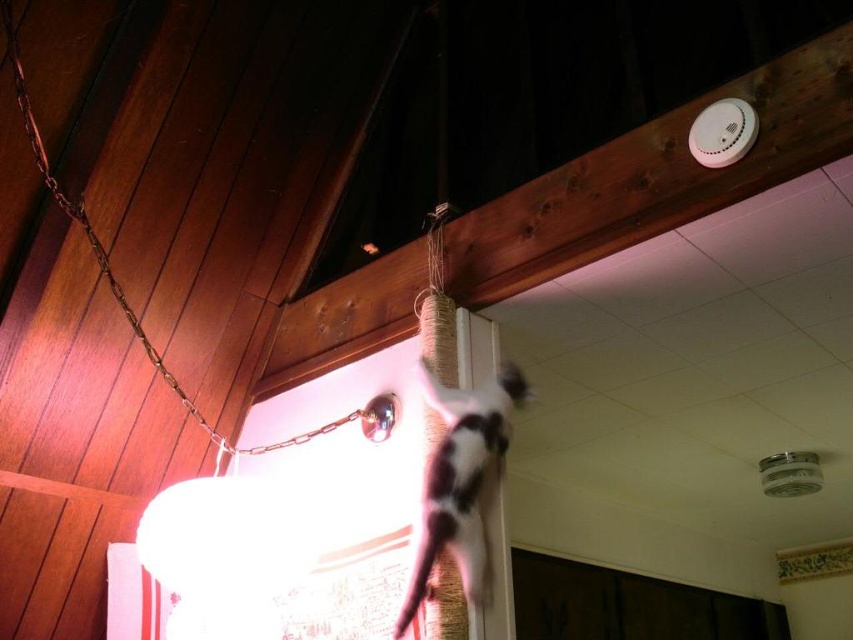
You are an interior designer assessing the lighting in the room. The white fur cat at upper center and the metallic chain at upper left are both under the light. Which object will cast a wider shadow?

The metallic chain at upper left is wider than the white fur cat at upper center, so it will cast a wider shadow.

You are a photographer trying to capture the white fur cat at upper center and the metallic chain at upper left in the same frame. Based on their positions, which object is closer to the right side of the image?

The white fur cat at upper center is closer to the right side of the image compared to the metallic chain at upper left.

You are an interior designer assessing the lighting in this room. You notice the white fur cat at upper center and the metallic chain at upper left. Which object is closer to the ceiling?

The metallic chain at upper left is closer to the ceiling because the white fur cat at upper center is positioned under it.